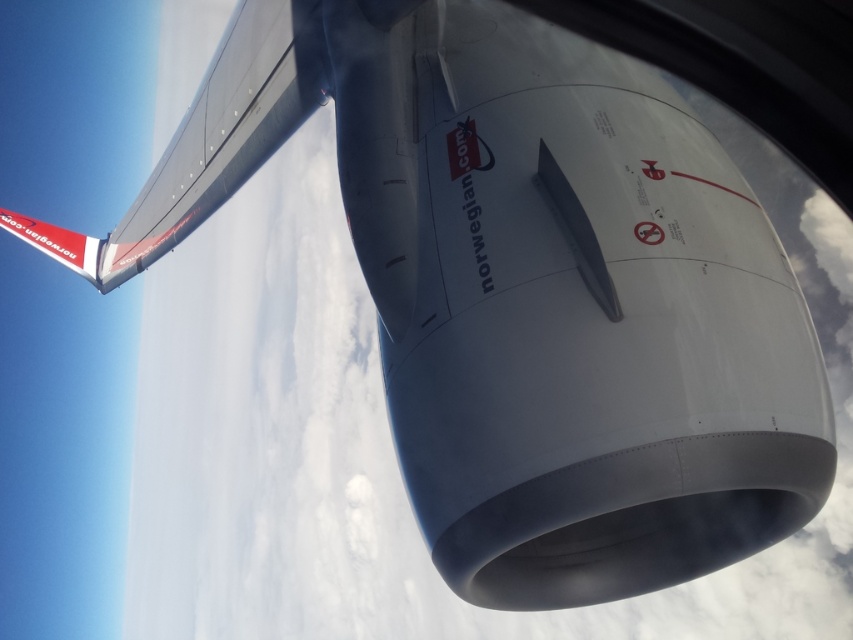
Question: Does polished metallic wing at upper left have a larger size compared to white glossy tail at upper left?

Choices:
 (A) no
 (B) yes

Answer: (B)

Question: Is polished metallic wing at upper left thinner than white glossy tail at upper left?

Choices:
 (A) yes
 (B) no

Answer: (B)

Question: Which object appears farthest from the camera in this image?

Choices:
 (A) white glossy tail at upper left
 (B) polished metallic wing at upper left

Answer: (A)

Question: Which object is closer to the camera taking this photo?

Choices:
 (A) polished metallic wing at upper left
 (B) white glossy tail at upper left

Answer: (A)

Question: Does polished metallic wing at upper left have a smaller size compared to white glossy tail at upper left?

Choices:
 (A) yes
 (B) no

Answer: (B)